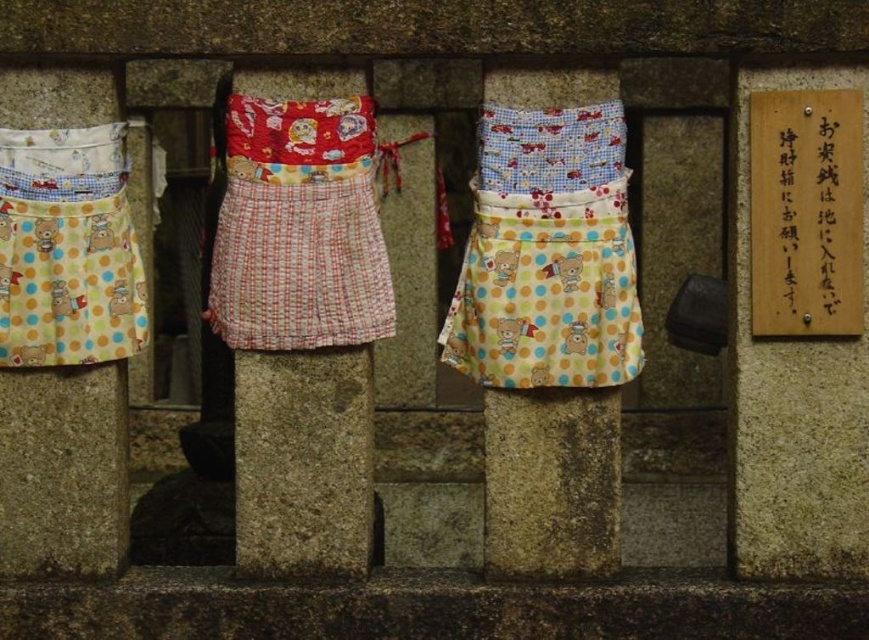
You are standing in front of the stone railing with the colorful fabric pouches. Where exactly is the red plaid apron at center located?

The red plaid apron at center is located at point (x=299, y=228).